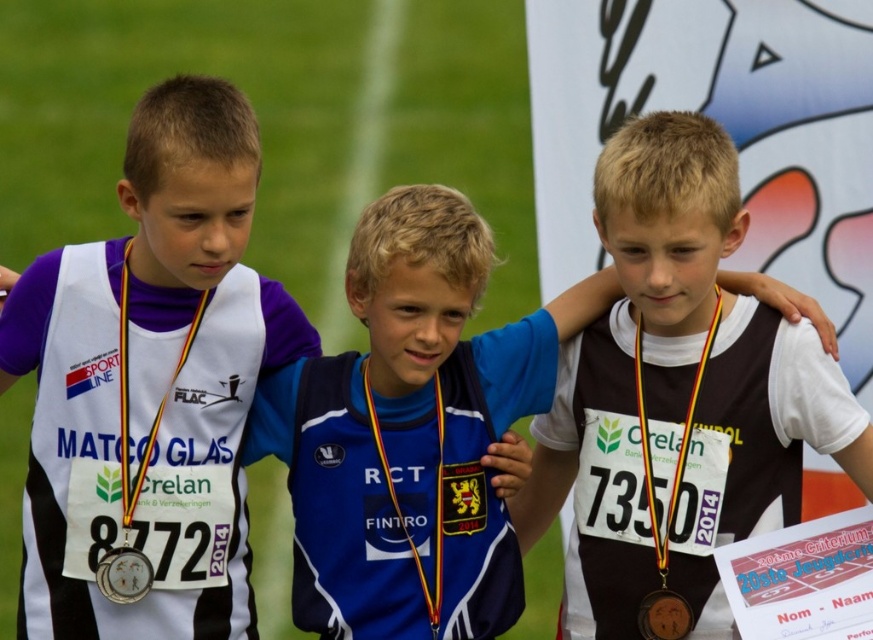
Question: Can you confirm if matte black vest at left is thinner than brown fabric shirt at center?

Choices:
 (A) no
 (B) yes

Answer: (B)

Question: Considering the real-world distances, which object is closest to the blue fabric shirt at center?

Choices:
 (A) brown fabric shirt at center
 (B) matte gold medal at center
 (C) gold metallic medal at center
 (D) white matte neck at center

Answer: (D)

Question: Which object appears farthest from the camera in this image?

Choices:
 (A) matte black vest at left
 (B) silver metallic medal at center
 (C) brown fabric shirt at center
 (D) white matte neck at center

Answer: (B)

Question: Which of the following is the farthest from the observer?

Choices:
 (A) blue fabric shirt at center
 (B) brown fabric shirt at center
 (C) blue jersey at center

Answer: (A)

Question: Does matte black vest at left have a lesser width compared to brown fabric shirt at center?

Choices:
 (A) no
 (B) yes

Answer: (B)

Question: Can you confirm if brown fabric shirt at center is positioned below matte gold medal at center?

Choices:
 (A) yes
 (B) no

Answer: (A)